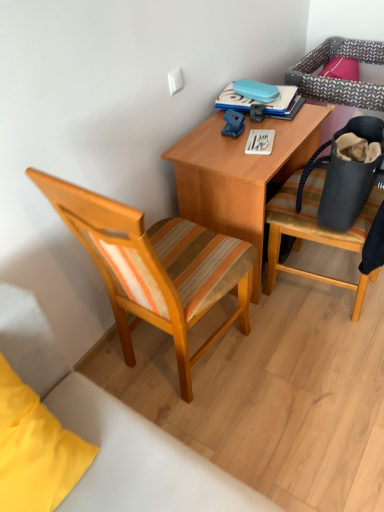
You are a GUI agent. You are given a task and a screenshot of the screen. Output one action in this format:
    pyautogui.click(x=<x>, y=<y>)
    Task: Click on the vacant area that lies between woodenchair at left, which is counted as the second chair, starting from the right, and wooden striped cushioned chair at right, the 1th chair positioned from the right
    The width and height of the screenshot is (384, 512).
    Given the screenshot: What is the action you would take?
    pyautogui.click(x=288, y=354)